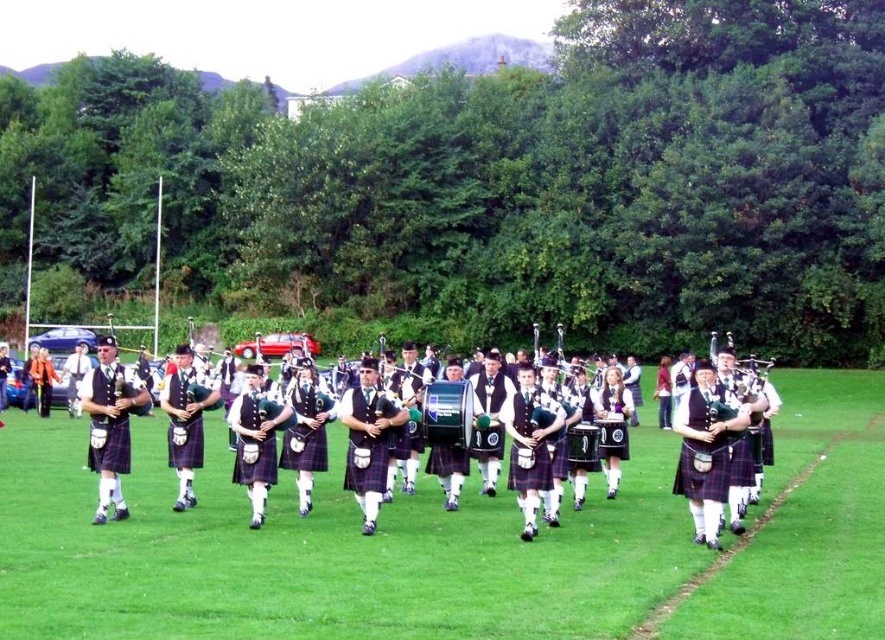
Question: Is green grass at center below matte green bagpipe at center?

Choices:
 (A) yes
 (B) no

Answer: (A)

Question: Considering the relative positions of green grass at center and matte green bagpipe at center in the image provided, where is green grass at center located with respect to matte green bagpipe at center?

Choices:
 (A) above
 (B) below

Answer: (B)

Question: Which point appears farthest from the camera in this image?

Choices:
 (A) (531, 408)
 (B) (127, 385)
 (C) (55, 435)

Answer: (C)

Question: Which of the following is the farthest from the observer?

Choices:
 (A) (864, 564)
 (B) (522, 436)
 (C) (119, 364)

Answer: (C)

Question: Based on their relative distances, which object is farther from the green grass at center?

Choices:
 (A) matte black kilt at center
 (B) matte green bagpipe at center

Answer: (A)

Question: Can you confirm if green grass at center is positioned above matte green bagpipe at center?

Choices:
 (A) yes
 (B) no

Answer: (B)